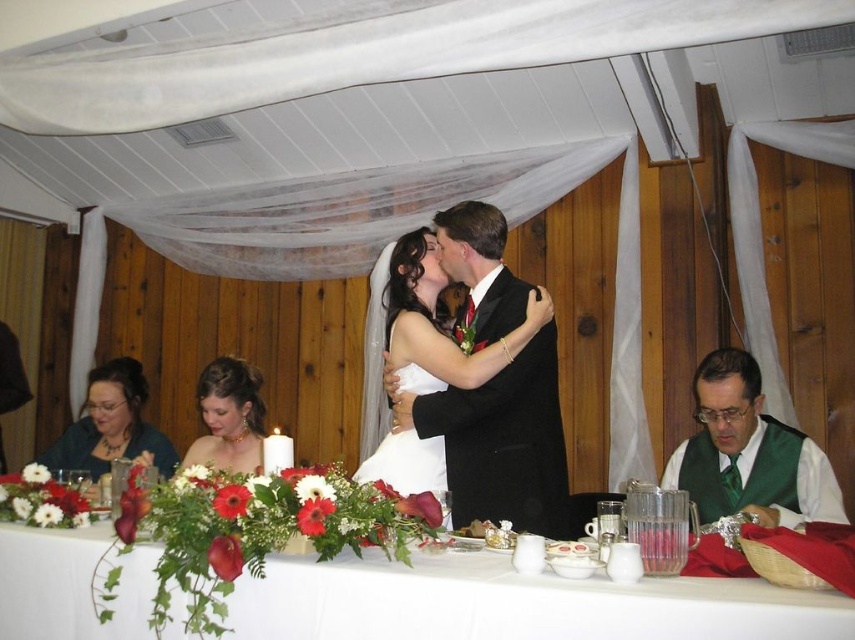
Question: Is matte white dress at center bigger than matte gold necklace at center?

Choices:
 (A) no
 (B) yes

Answer: (B)

Question: Is white fabric table at center wider than matte gold necklace at center?

Choices:
 (A) yes
 (B) no

Answer: (A)

Question: Can you confirm if white fabric table at center is thinner than matte gold necklace at center?

Choices:
 (A) yes
 (B) no

Answer: (B)

Question: Which is farther from the green satin vest at lower right?

Choices:
 (A) white fabric table at center
 (B) green fabric at left
 (C) matte gold necklace at center
 (D) matte white dress at center

Answer: (B)

Question: Which object appears farthest from the camera in this image?

Choices:
 (A) matte gold necklace at center
 (B) white fabric table at center
 (C) matte white dress at center

Answer: (A)

Question: Considering the real-world distances, which object is closest to the green satin vest at lower right?

Choices:
 (A) white fabric table at center
 (B) matte white dress at center
 (C) matte gold necklace at center

Answer: (B)